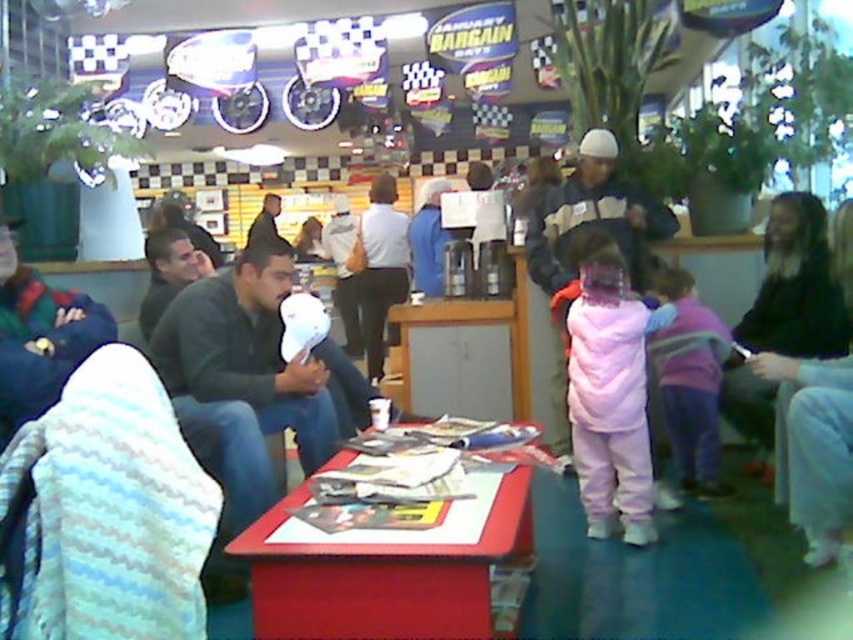
Is pink fleece jacket at center below striped knit sweater at center?

Yes, pink fleece jacket at center is below striped knit sweater at center.

Is pink fleece jacket at center shorter than striped knit sweater at center?

Correct, pink fleece jacket at center is not as tall as striped knit sweater at center.

Image resolution: width=853 pixels, height=640 pixels. Identify the location of pink fleece jacket at center. (611, 394).

Is point (648, 241) less distant than point (16, 268)?

No, (648, 241) is further to viewer.

Does striped knit sweater at center appear under green fleece jacket at left?

No, striped knit sweater at center is not below green fleece jacket at left.

Where is `striped knit sweater at center`? striped knit sweater at center is located at coordinates (593, 218).

Which is behind, point (387, 582) or point (669, 497)?

The point (669, 497) is behind.

Can you confirm if red plastic table at center is shorter than pink fleece jacket at center?

Yes, red plastic table at center is shorter than pink fleece jacket at center.

What do you see at coordinates (381, 576) in the screenshot?
I see `red plastic table at center` at bounding box center [381, 576].

This screenshot has height=640, width=853. In order to click on red plastic table at center in this screenshot , I will do `click(381, 576)`.